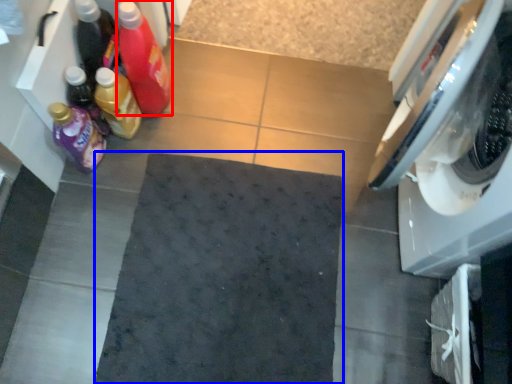
Question: Which of the following is the closest to the observer, bottle (highlighted by a red box) or bath mat (highlighted by a blue box)?

Choices:
 (A) bottle
 (B) bath mat

Answer: (A)